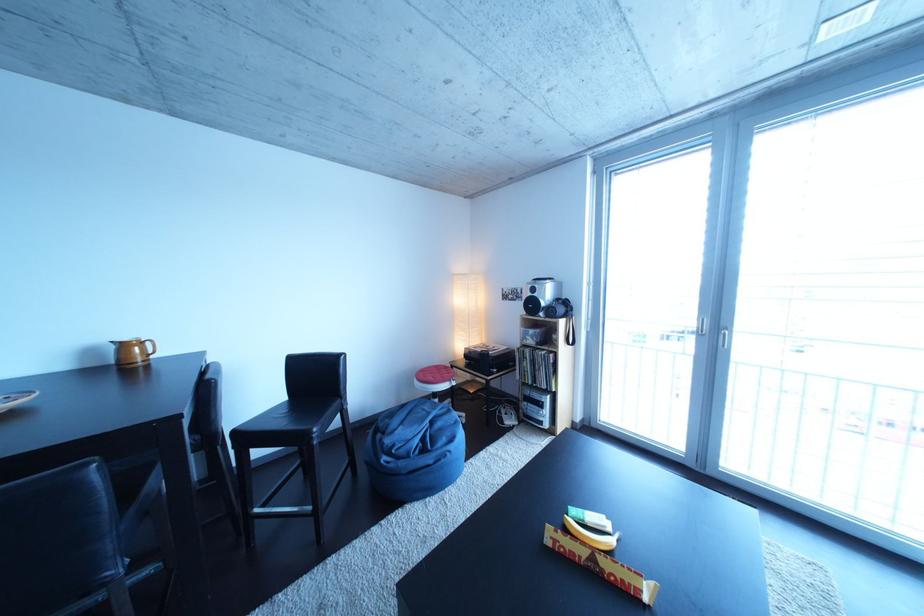
Where is `blue beanbag sitting surface`? The image size is (924, 616). blue beanbag sitting surface is located at coordinates (415, 450).